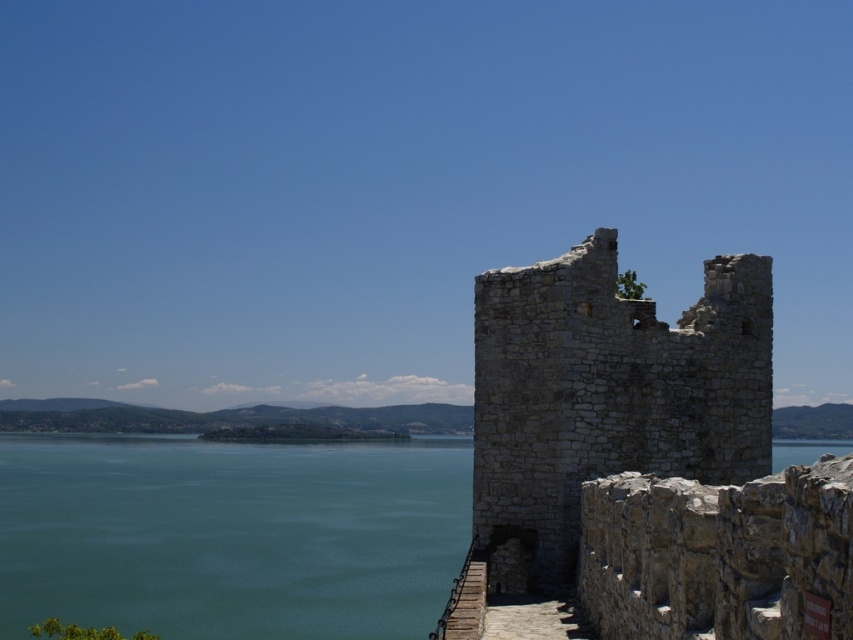
You are standing at the base of the ancient stone structure in the image and want to take a photo of both the point at coordinates point (x=4, y=579) and point (x=618, y=352). Which point is closer to your camera when you take the photo?

Point (x=4, y=579) is further to the camera than point (x=618, y=352), so the point closer to your camera would be point (x=618, y=352).

You are standing at the edge of the lake and see both the green water at lower left and the gray stone ruins at center. Which object is positioned to the left of the other?

The green water at lower left is to the left of the gray stone ruins at center.